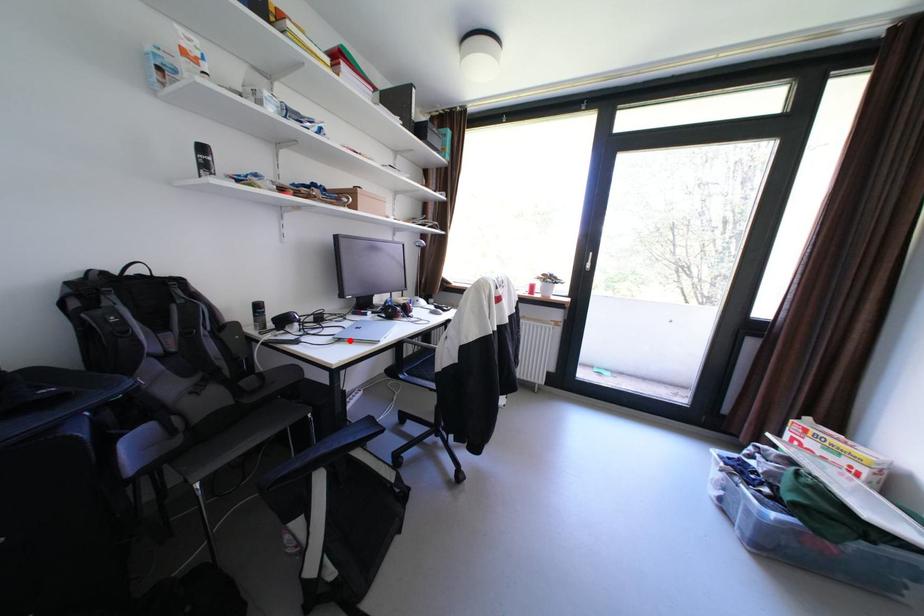
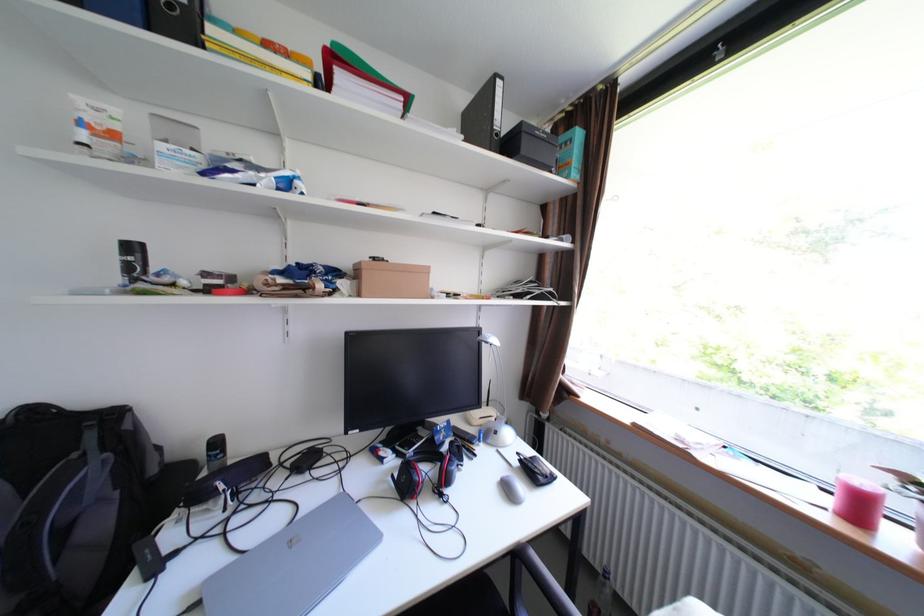
Find the pixel in the second image that matches the highlighted location in the first image.

(208, 604)